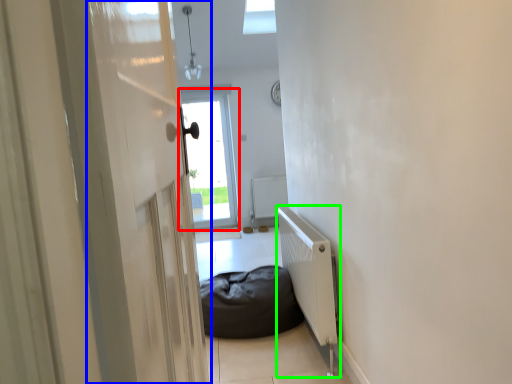
Question: Estimate the real-world distances between objects in this image. Which object is closer to window (highlighted by a red box), screen door (highlighted by a blue box) or radiator (highlighted by a green box)?

Choices:
 (A) screen door
 (B) radiator

Answer: (B)